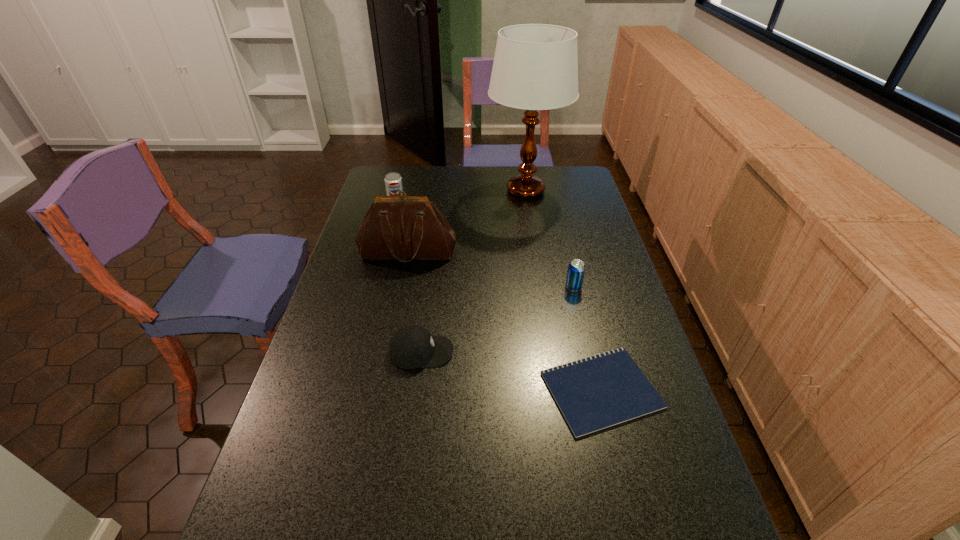
Identify the location of table lamp. (535, 67).

In order to click on shoulder bag in this screenshot , I will do `click(406, 228)`.

You are a GUI agent. You are given a task and a screenshot of the screen. Output one action in this format:
    pyautogui.click(x=<x>, y=<y>)
    Task: Click on the fifth shortest object
    The height and width of the screenshot is (540, 960).
    Given the screenshot: What is the action you would take?
    pyautogui.click(x=406, y=228)

Where is `soda`? soda is located at coordinates (393, 181).

Find the location of a particular element. The image size is (960, 540). the fourth farthest object is located at coordinates (576, 269).

You are a GUI agent. You are given a task and a screenshot of the screen. Output one action in this format:
    pyautogui.click(x=<x>, y=<y>)
    Task: Click on the beer can
    This screenshot has height=540, width=960.
    Given the screenshot: What is the action you would take?
    pyautogui.click(x=576, y=269)

Locate an element on the screen. The image size is (960, 540). the second shortest object is located at coordinates (410, 347).

Locate an element on the screen. the shortest object is located at coordinates (601, 391).

The width and height of the screenshot is (960, 540). In order to click on vacant point located on the front of the table lamp in this screenshot , I will do `click(534, 244)`.

Find the location of a particular element. The width and height of the screenshot is (960, 540). blank area located on the right of the fifth shortest object is located at coordinates (509, 252).